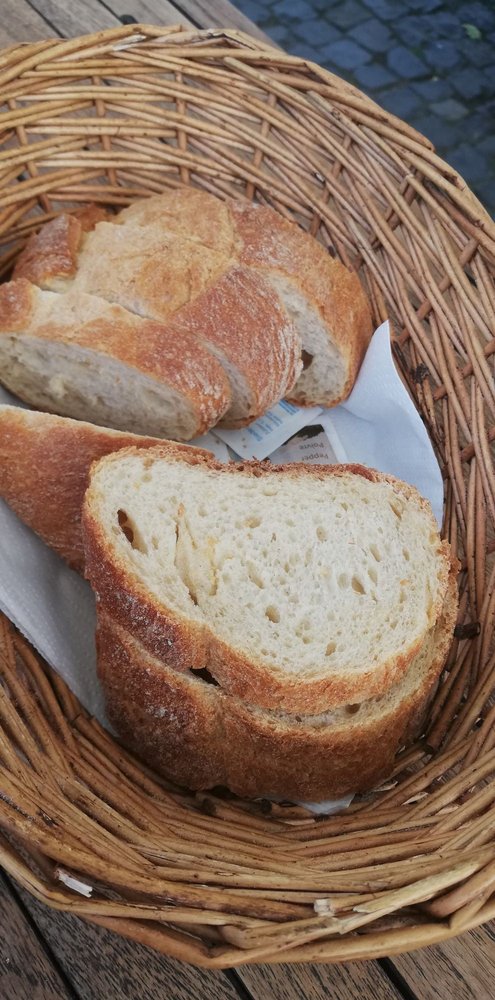
Locate an element on the screen. The height and width of the screenshot is (1000, 495). wicker basket is located at coordinates (385, 186).